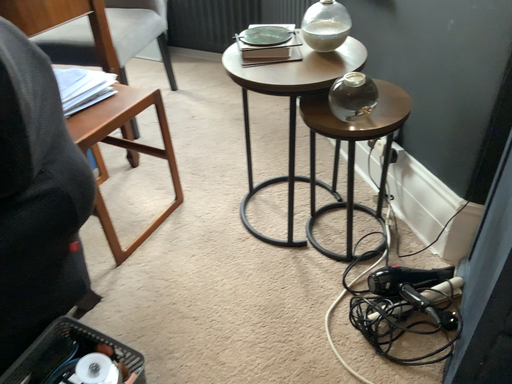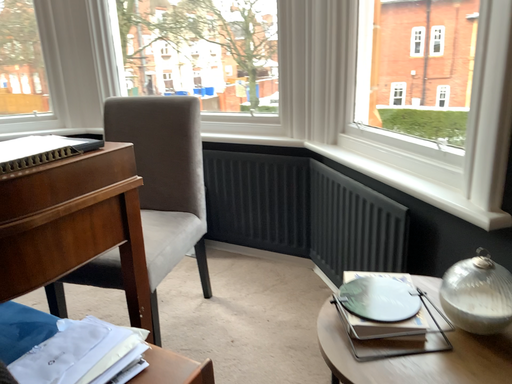
Question: Which way did the camera rotate in the video?

Choices:
 (A) rotated upward
 (B) rotated downward

Answer: (A)